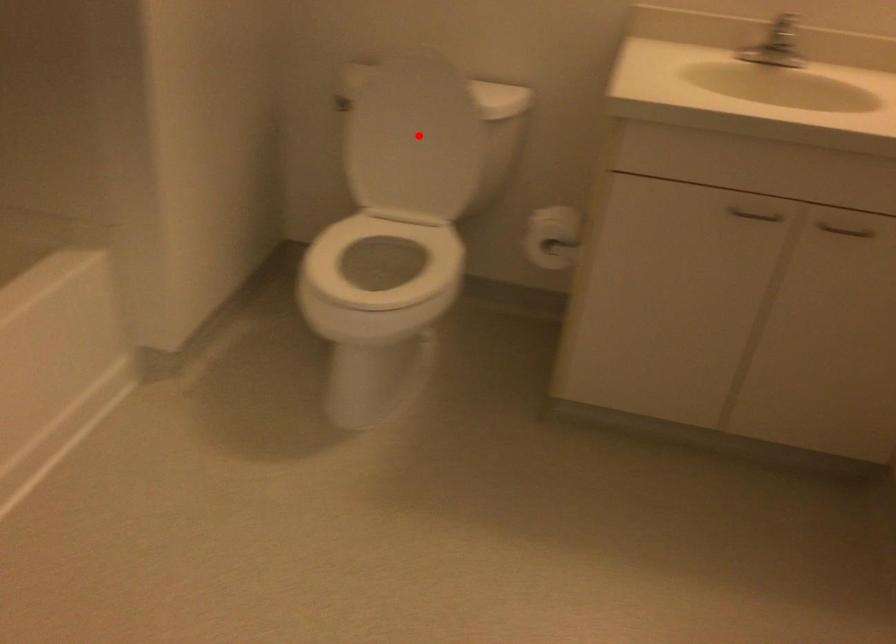
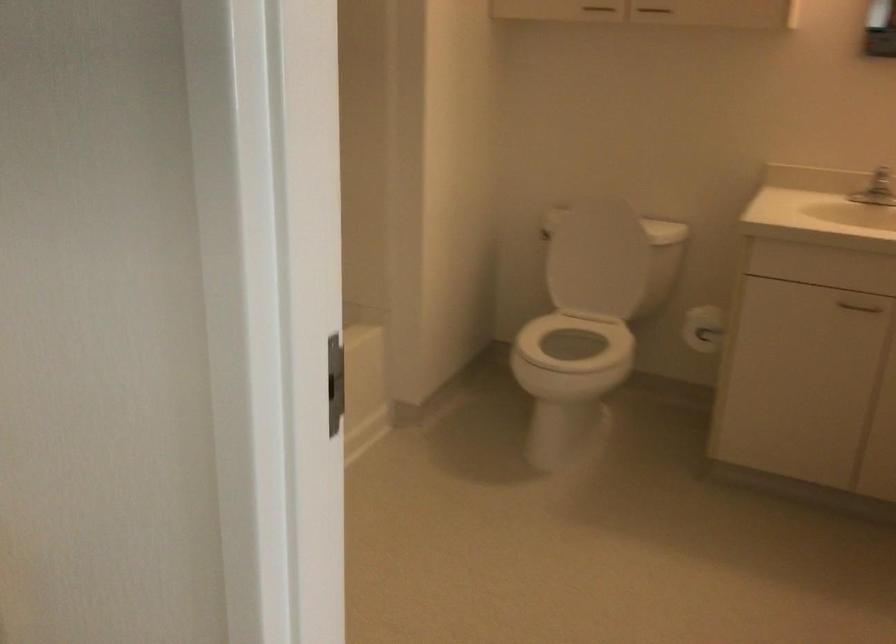
Question: I am providing you with two images of the same scene from different viewpoints. In image1, a red point is highlighted. Considering the same 3D point in image2, which of the following is correct?

Choices:
 (A) It is closer
 (B) It is farther

Answer: (B)